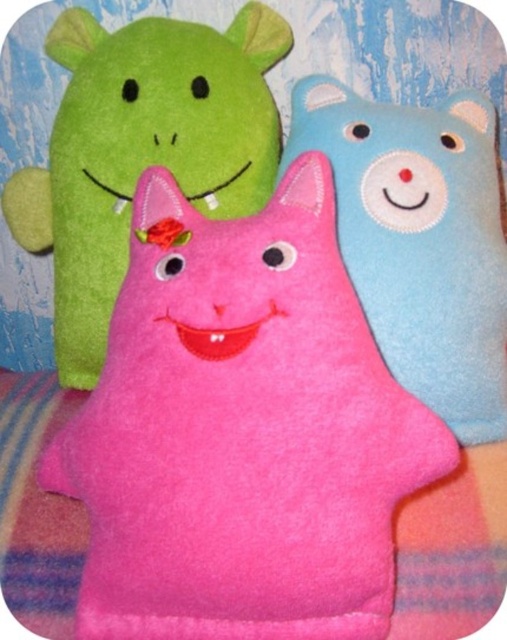
You are holding a 30 inch ruler and want to measure the distance between the pink felt cat at center and the camera. Can you determine if the ruler will be long enough to reach that distance?

The distance between the pink felt cat at center and the camera is 29.98 inches, so the 30 inch ruler is just long enough to reach the distance.

You are a child trying to reach both the matte pink plush at center and the blue felt bear at upper right from your current position. Which toy will you touch first?

The matte pink plush at center is closer to you than the blue felt bear at upper right, so you will touch the matte pink plush at center first.